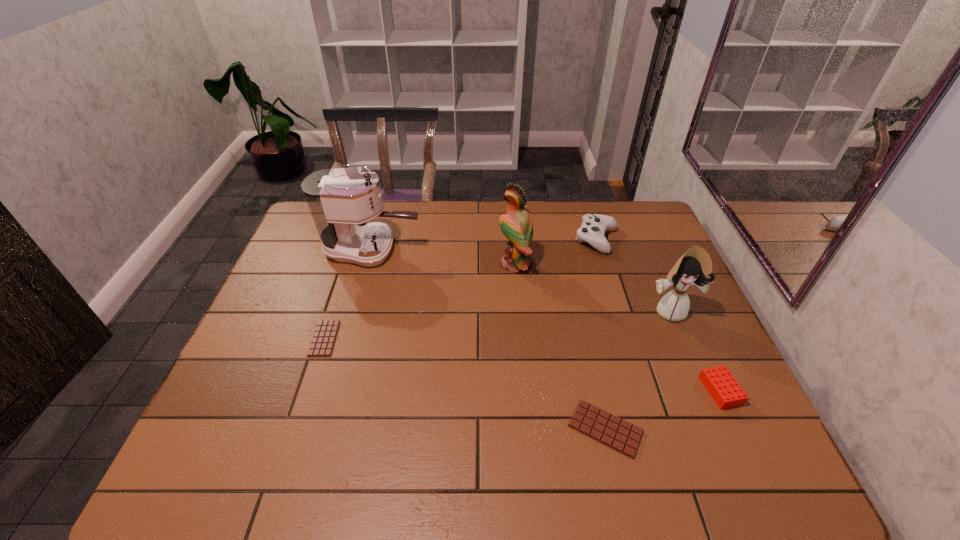
Find the location of a particular element. candy bar that is at the near edge is located at coordinates (602, 426).

Where is `Lego located in the near edge section of the desktop`? The width and height of the screenshot is (960, 540). Lego located in the near edge section of the desktop is located at coordinates (724, 389).

The height and width of the screenshot is (540, 960). I want to click on object located in the left edge section of the desktop, so pyautogui.click(x=341, y=201).

Locate an element on the screen. This screenshot has width=960, height=540. control that is at the right edge is located at coordinates (594, 226).

Image resolution: width=960 pixels, height=540 pixels. I want to click on doll located at the right edge, so click(694, 268).

In order to click on Lego positioned at the right edge in this screenshot , I will do `click(724, 389)`.

Locate an element on the screen. The width and height of the screenshot is (960, 540). object that is at the far left corner is located at coordinates (341, 201).

The height and width of the screenshot is (540, 960). Find the location of `object at the far right corner`. object at the far right corner is located at coordinates tap(594, 226).

The height and width of the screenshot is (540, 960). In order to click on object positioned at the near right corner in this screenshot , I will do `click(724, 389)`.

The height and width of the screenshot is (540, 960). Identify the location of blank space at the far edge of the desktop. (395, 206).